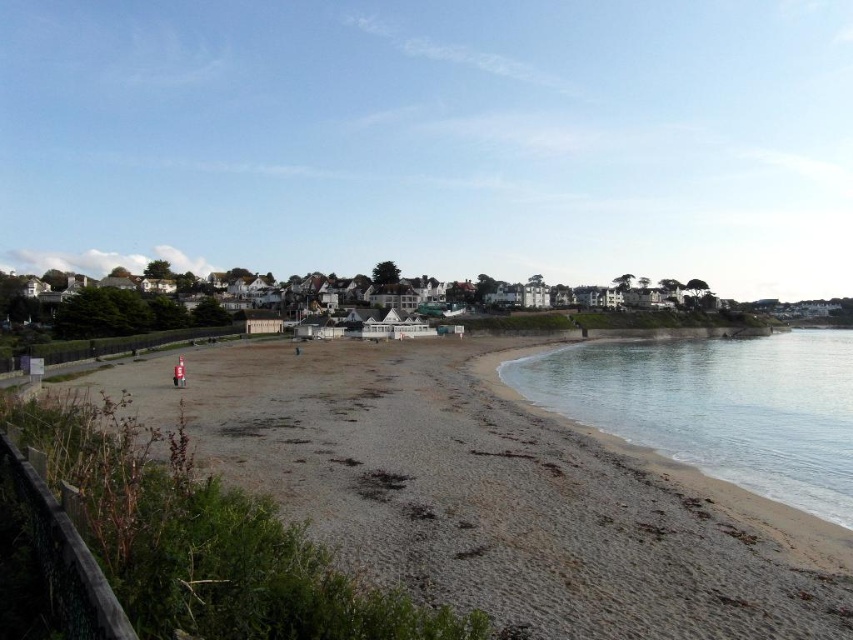
You are standing on the wooden railing on the left side of the frame. You want to walk towards the clear water at beach right. Which direction should you move relative to the gray gravelly sand at lower left?

You should move away from the gray gravelly sand at lower left because the clear water at beach right is located to the right side of the beach, while the gray gravelly sand at lower left is positioned to the left side. Moving towards the right direction will lead you closer to the clear water at beach right.

You are standing on the wooden railing on the left side of the frame and want to walk towards the clear water at beach right. Which direction should you go to avoid the gray gravelly sand at lower left?

To avoid the gray gravelly sand at lower left, you should move towards the clear water at beach right since the gray gravelly sand at lower left is taller and might block your path.